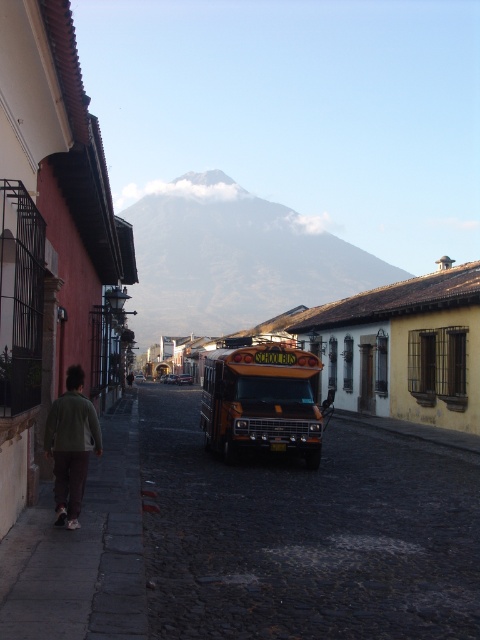
Question: Can you confirm if cobblestone pavement at center is positioned to the left of yellow metallic school bus at center?

Choices:
 (A) yes
 (B) no

Answer: (A)

Question: Does yellow metallic school bus at center appear under green fabric jacket at lower left?

Choices:
 (A) yes
 (B) no

Answer: (A)

Question: Among these objects, which one is farthest from the camera?

Choices:
 (A) cobblestone pavement at center
 (B) yellow metallic school bus at center
 (C) green fabric jacket at lower left

Answer: (B)

Question: Which of the following is the farthest from the observer?

Choices:
 (A) (44, 448)
 (B) (262, 372)

Answer: (B)

Question: Estimate the real-world distances between objects in this image. Which object is closer to the green fabric jacket at lower left?

Choices:
 (A) yellow metallic school bus at center
 (B) cobblestone pavement at center

Answer: (B)

Question: Is yellow metallic school bus at center wider than green fabric jacket at lower left?

Choices:
 (A) yes
 (B) no

Answer: (A)